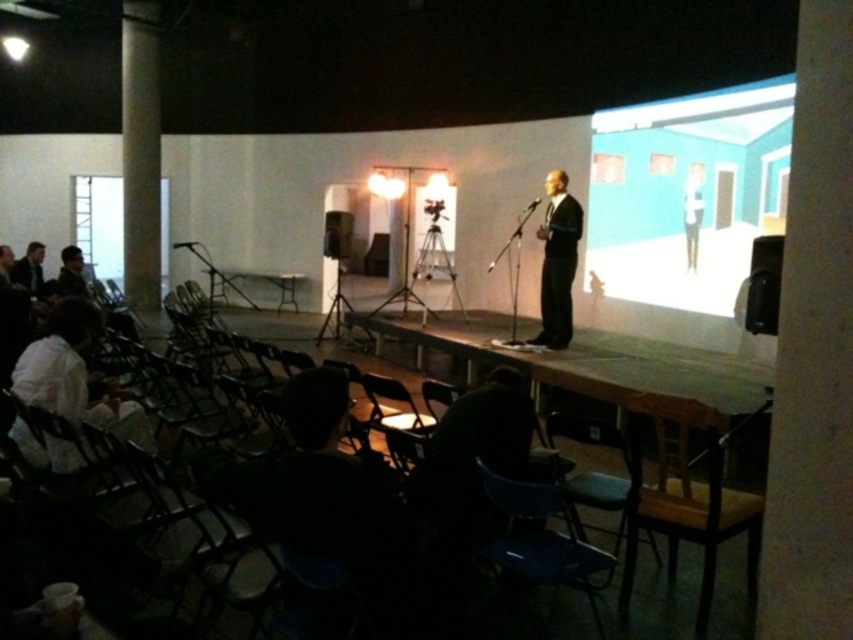
You are organizing a small workshop and need to seat participants. You have a green plastic chair at lower center and a dark suit at center. Which object takes up more space in the room?

The dark suit at center occupies more space than the green plastic chair at lower center.

You are sitting in the front row of the audience and need to reach the stage. There is a green plastic chair at lower center and a matte black suit at left in your way. Which object do you need to move to get to the stage?

The green plastic chair at lower center is much taller than the matte black suit at left, so you need to move the green plastic chair at lower center to get to the stage.